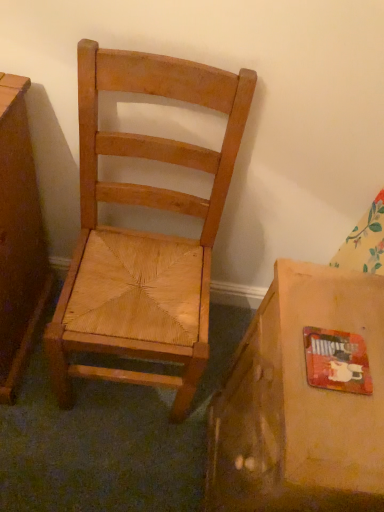
At what (x,y) coordinates should I click in order to perform the action: click on vacant area on top of matte cardboard box at lower right (from a real-world perspective). Please return your answer as a coordinate pair (x, y). Looking at the image, I should click on (331, 357).